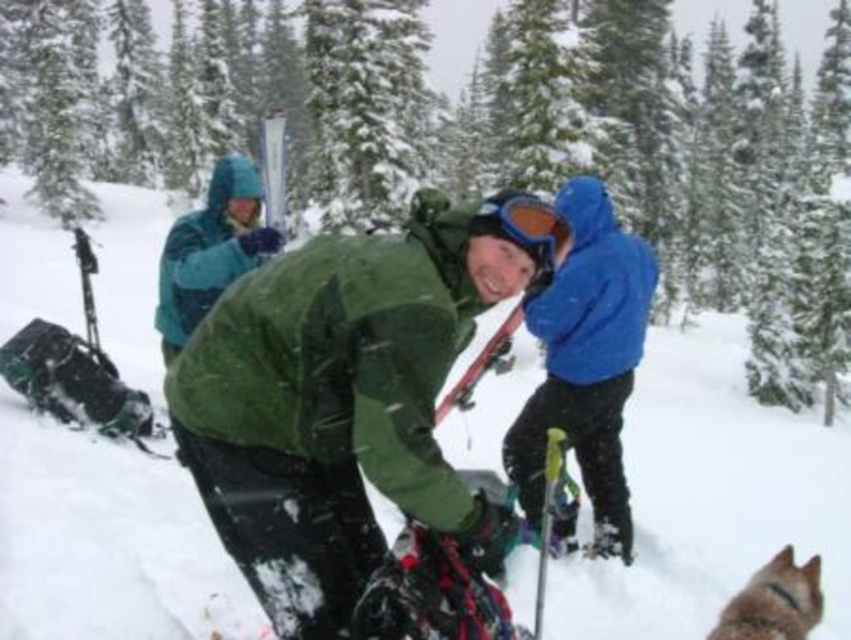
You are standing at point [709,497] in the snowy forest scene. What is the surface you are standing on?

The surface at point [709,497] is white matte snow at center.

You are planning to take a photo of the teal fleece jacket at upper left and the matte red ski at center in the snowy scene. Which object should you focus on first if you want to capture both in a single frame without moving the camera?

The teal fleece jacket at upper left should be focused on first because it is taller than the matte red ski at center, ensuring it fits within the frame when positioned properly.